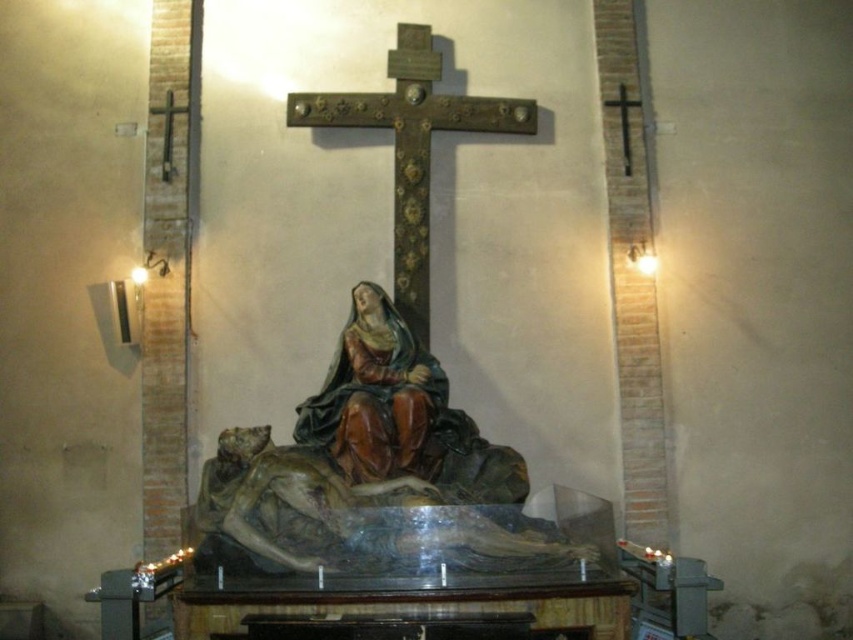
Is polished wood cross at center smaller than black wood cross at upper right?

Indeed, polished wood cross at center has a smaller size compared to black wood cross at upper right.

Image resolution: width=853 pixels, height=640 pixels. What do you see at coordinates (412, 147) in the screenshot?
I see `polished wood cross at center` at bounding box center [412, 147].

The width and height of the screenshot is (853, 640). Find the location of `polished wood cross at center`. polished wood cross at center is located at coordinates pyautogui.click(x=412, y=147).

Who is positioned more to the left, wooden statue at center or black wood cross at upper right?

Positioned to the left is wooden statue at center.

Which is in front, point (474, 516) or point (619, 97)?

Positioned in front is point (474, 516).

In order to click on wooden statue at center in this screenshot , I will do `click(376, 470)`.

Consider the image. Can you confirm if wooden statue at center is positioned to the left of matte brown statue at center?

No, wooden statue at center is not to the left of matte brown statue at center.

Between wooden statue at center and matte brown statue at center, which one has less height?

Standing shorter between the two is wooden statue at center.

Measure the distance between point (212, 460) and camera.

23.78 meters

Find the location of a particular element. This screenshot has height=640, width=853. wooden statue at center is located at coordinates (376, 470).